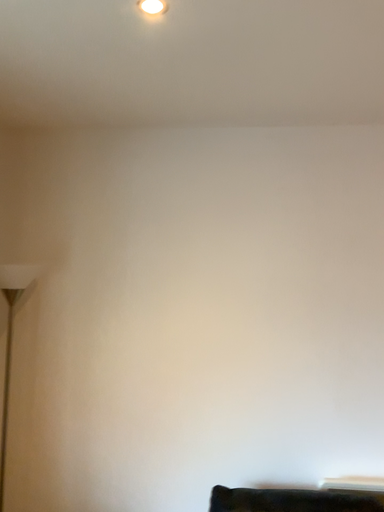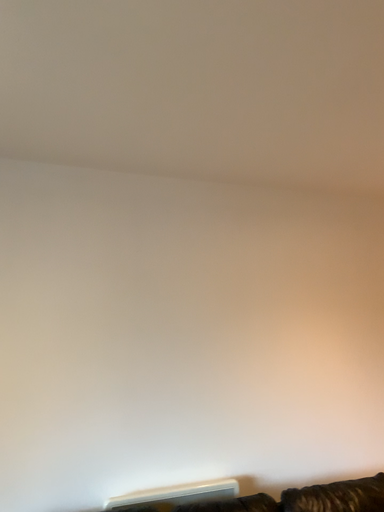
Question: Which way did the camera rotate in the video?

Choices:
 (A) rotated left
 (B) rotated right

Answer: (B)